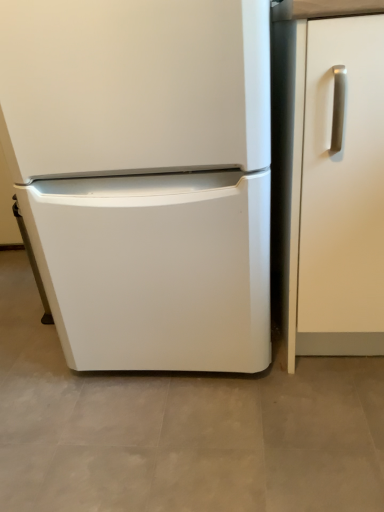
Question: Should I look upward or downward to see white matte cabinet handle at right?

Choices:
 (A) down
 (B) up

Answer: (B)

Question: From the image's perspective, is white matte refrigerator at center beneath white matte cabinet handle at right?

Choices:
 (A) yes
 (B) no

Answer: (B)

Question: Is white matte refrigerator at center outside of white matte cabinet handle at right?

Choices:
 (A) no
 (B) yes

Answer: (B)

Question: Considering the relative sizes of white matte refrigerator at center and white matte cabinet handle at right in the image provided, is white matte refrigerator at center thinner than white matte cabinet handle at right?

Choices:
 (A) yes
 (B) no

Answer: (B)

Question: Does white matte refrigerator at center come behind white matte cabinet handle at right?

Choices:
 (A) no
 (B) yes

Answer: (A)

Question: Does white matte refrigerator at center have a larger size compared to white matte cabinet handle at right?

Choices:
 (A) no
 (B) yes

Answer: (B)

Question: Can you confirm if white matte refrigerator at center is taller than white matte cabinet handle at right?

Choices:
 (A) yes
 (B) no

Answer: (A)

Question: Can you confirm if white matte cabinet handle at right is positioned to the left of white matte refrigerator at center?

Choices:
 (A) yes
 (B) no

Answer: (B)

Question: From a real-world perspective, is white matte cabinet handle at right physically above white matte refrigerator at center?

Choices:
 (A) yes
 (B) no

Answer: (B)

Question: Is white matte cabinet handle at right aimed at white matte refrigerator at center?

Choices:
 (A) yes
 (B) no

Answer: (B)

Question: Is white matte refrigerator at center inside white matte cabinet handle at right?

Choices:
 (A) no
 (B) yes

Answer: (A)

Question: Can you confirm if white matte cabinet handle at right is thinner than white matte refrigerator at center?

Choices:
 (A) yes
 (B) no

Answer: (A)

Question: Considering the relative sizes of white matte cabinet handle at right and white matte refrigerator at center in the image provided, is white matte cabinet handle at right shorter than white matte refrigerator at center?

Choices:
 (A) no
 (B) yes

Answer: (B)

Question: In the image, is white matte refrigerator at center on the left side or the right side of white matte cabinet handle at right?

Choices:
 (A) right
 (B) left

Answer: (B)